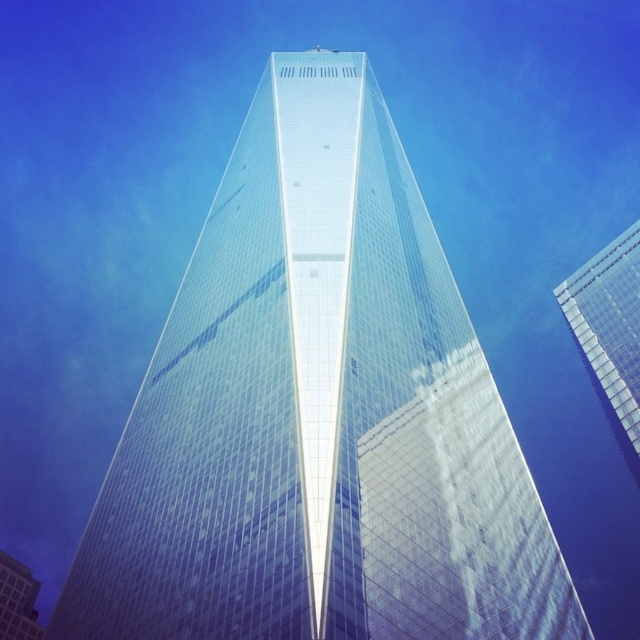
You are an architect evaluating the structural integrity of the transparent glass skyscraper at right. You need to locate a specific point for analysis. Is the point at coordinates (x=609, y=333) on the transparent glass skyscraper at right or the other building?

The point at coordinates (x=609, y=333) is on the transparent glass skyscraper at right, as stated in the description.

You are a drone operator tasked with flying a drone between the transparent glass skyscraper at right and the transparent glass skyscraper at center. The drone has a maximum flight distance of 500 feet. Can the drone safely fly between them without exceeding its range?

The transparent glass skyscraper at right and transparent glass skyscraper at center are 542.05 feet apart. Since the drone has a maximum flight distance of 500 feet, it cannot safely fly between them without exceeding its range.

You are an architect analyzing the image of two transparent glass skyscrapers. Based on the scene, can you determine whether the transparent glass skyscraper at right is wider than the transparent glass skyscraper at center?

The transparent glass skyscraper at right might be wider than transparent glass skyscraper at center according to the description.